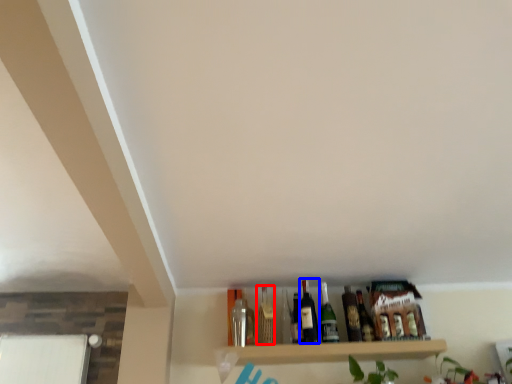
Question: Which object appears closest to the camera in this image, wine bottle (highlighted by a red box) or beer bottle (highlighted by a blue box)?

Choices:
 (A) wine bottle
 (B) beer bottle

Answer: (B)